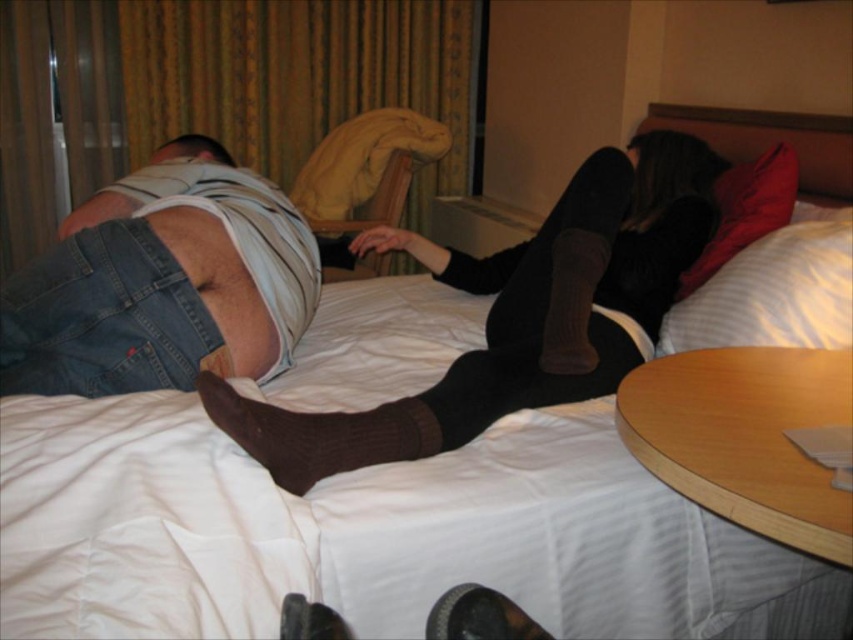
You are a hotel housekeeper inspecting the bed. You notice the black ribbed socks at center and the jeans at left. Which item is wider in terms of their width?

The black ribbed socks at center are wider than the jeans at left.

You are a hotel housekeeper entering a guest room to tidy up. You notice the black ribbed socks at center and the red soft pillow at upper right. Which object is closer to the left side of the bed?

The black ribbed socks at center are to the left of the red soft pillow at upper right, so they are closer to the left side of the bed.